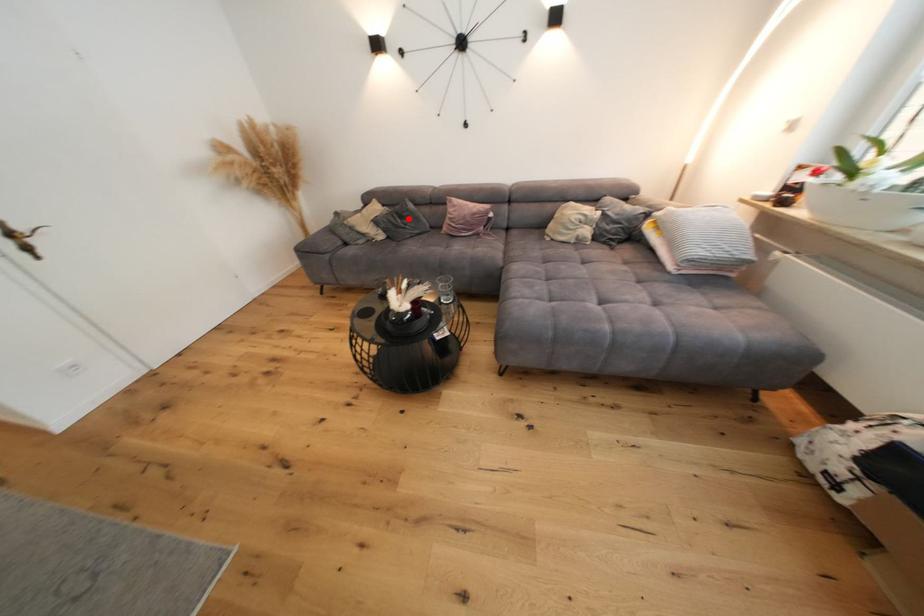
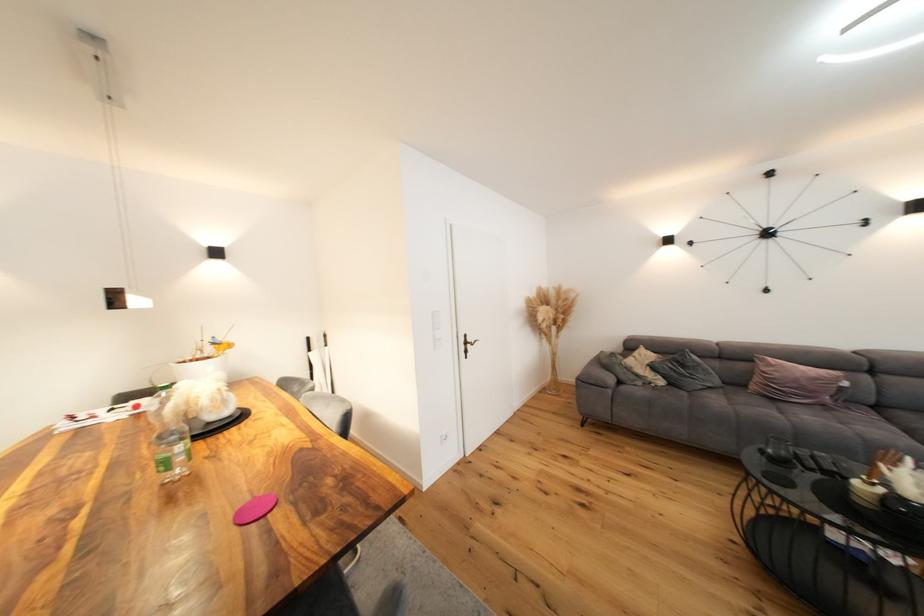
Where in the second image is the point corresponding to the highlighted location from the first image?

(690, 368)